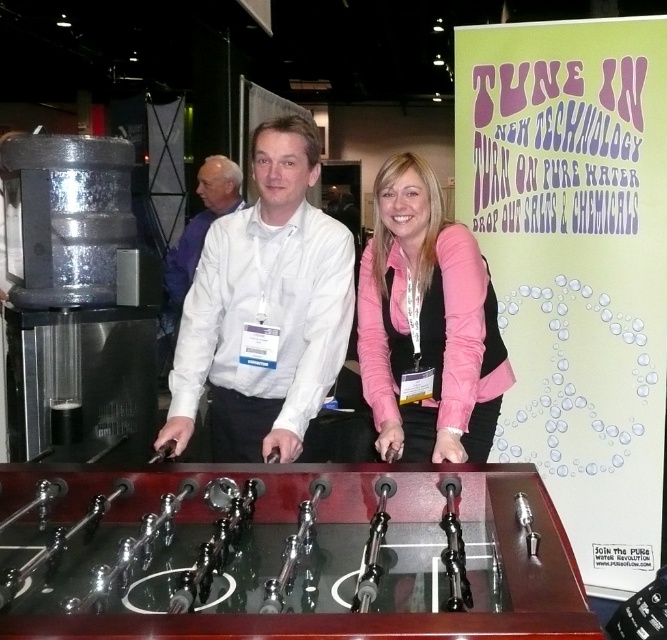
You are a photographer at the trade show and want to capture the shiny brown wooden foosball table at center in your photo. The camera is set to focus on objects at point coordinates between 0.7 and 0.7. Can you confirm if the table will be in focus?

The shiny brown wooden foosball table at center is located at point coordinates (x=283, y=554). Since the camera focuses between 0.7 and 0.7, the table is outside the focus range and will not be in focus.

You are a photographer at the event. You need to capture a photo where the white glossy shirt at center and the pink fabric shirt at center are both visible. Which shirt should you focus on to ensure both are in the frame?

The white glossy shirt at center is located above the pink fabric shirt at center, so focusing on the white glossy shirt at center will ensure both shirts are visible in the photo.

What is the exact coordinate of the shiny brown wooden foosball table at center?

The shiny brown wooden foosball table at center is located at point [283,554].